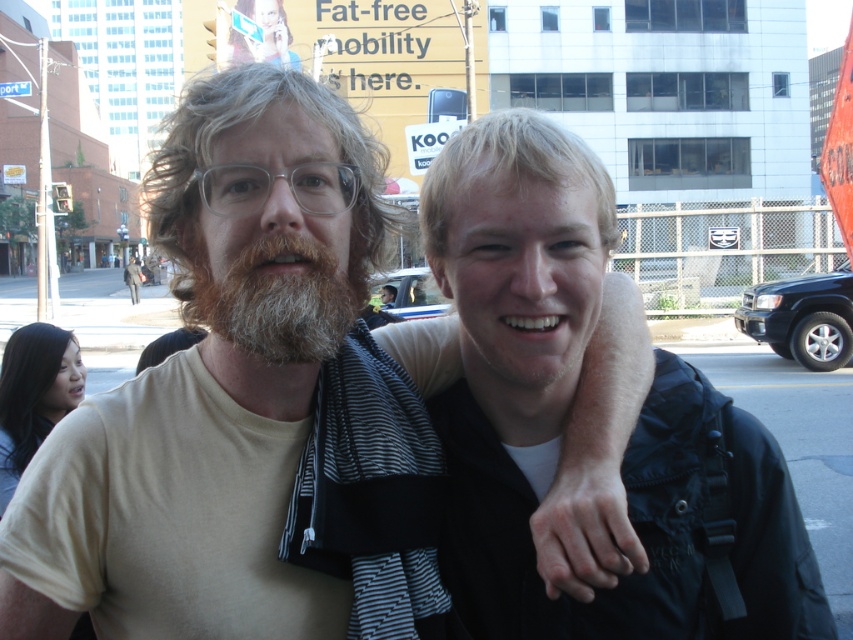
You are standing in an urban setting and see a black fabric backpack at center. Where is the backpack positioned relative to the two people?

The black fabric backpack at center is located at point coordinates of (567,406), so it is positioned to the lower right of the two people.